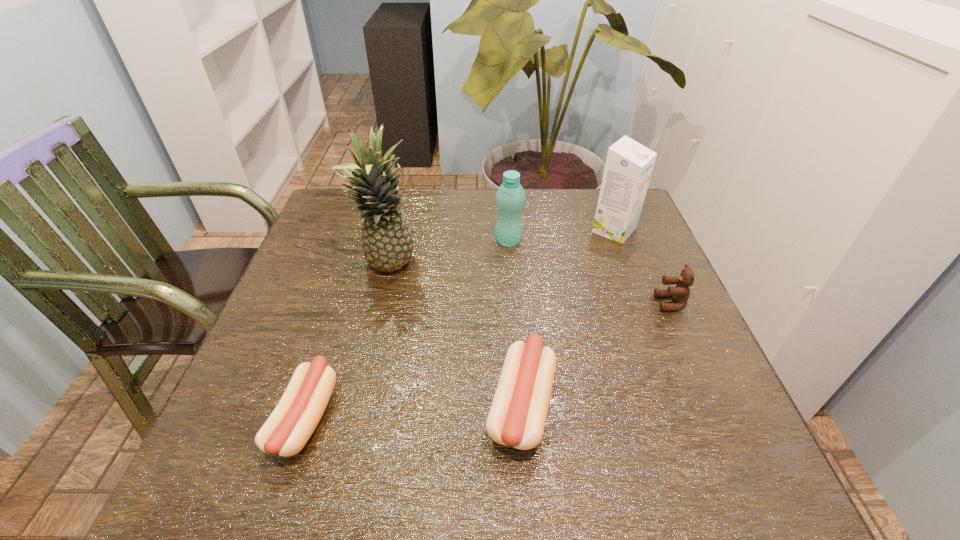
What are the coordinates of `free space at the near left corner` in the screenshot? It's located at (253, 435).

In the image, there is a desktop. At what (x,y) coordinates should I click in order to perform the action: click on vacant space at the far right corner. Please return your answer as a coordinate pair (x, y). This screenshot has height=540, width=960. Looking at the image, I should click on (590, 231).

Identify the location of free point between the pineapple and the teddy bear. This screenshot has width=960, height=540. (529, 285).

Identify the location of vacant space that's between the teddy bear and the fifth shortest object. (642, 267).

Where is `unoccupied area between the fifth shortest object and the pineapple`? unoccupied area between the fifth shortest object and the pineapple is located at coordinates (501, 249).

Where is `vacant area that lies between the carton and the shortest object`? Image resolution: width=960 pixels, height=540 pixels. vacant area that lies between the carton and the shortest object is located at coordinates (460, 324).

Locate an element on the screen. This screenshot has width=960, height=540. free space between the bottle and the fourth tallest object is located at coordinates (589, 272).

Identify the location of empty location between the third tallest object and the taller sausage. (515, 322).

What are the coordinates of `blank region between the tallest object and the bottle` in the screenshot? It's located at (448, 254).

Find the location of a particular element. The width and height of the screenshot is (960, 540). unoccupied position between the bottle and the teddy bear is located at coordinates (589, 272).